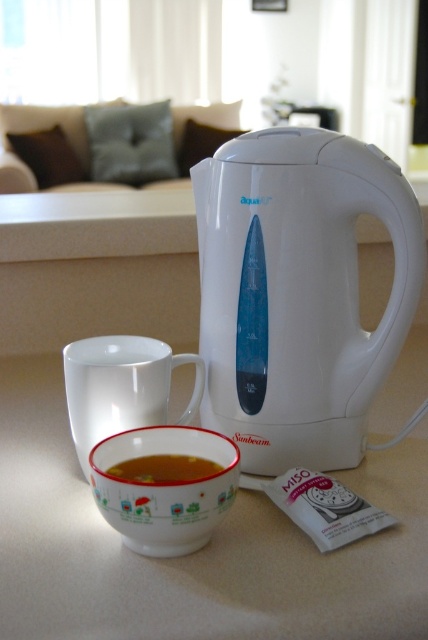
Does point (184, 442) come farther from viewer compared to point (133, 342)?

No.

This screenshot has height=640, width=428. What do you see at coordinates (163, 488) in the screenshot?
I see `white glossy mug at lower center` at bounding box center [163, 488].

Is point (157, 496) positioned before point (86, 472)?

Yes, point (157, 496) is closer to viewer.

Find the location of a particular element. The image size is (428, 640). white glossy mug at lower center is located at coordinates (163, 488).

Which is above, white glossy table at center or translucent glass bowl at lower center?

Positioned higher is white glossy table at center.

Is white glossy table at center smaller than translucent glass bowl at lower center?

Actually, white glossy table at center might be larger than translucent glass bowl at lower center.

Which is in front, point (29, 429) or point (208, 464)?

Point (208, 464) is more forward.

Locate an element on the screen. white glossy table at center is located at coordinates (193, 554).

Can you confirm if white glossy table at center is smaller than white glossy mug at lower center?

Incorrect, white glossy table at center is not smaller in size than white glossy mug at lower center.

Does white glossy table at center appear on the right side of white glossy mug at lower center?

Correct, you'll find white glossy table at center to the right of white glossy mug at lower center.

This screenshot has height=640, width=428. In order to click on white glossy table at center in this screenshot , I will do `click(193, 554)`.